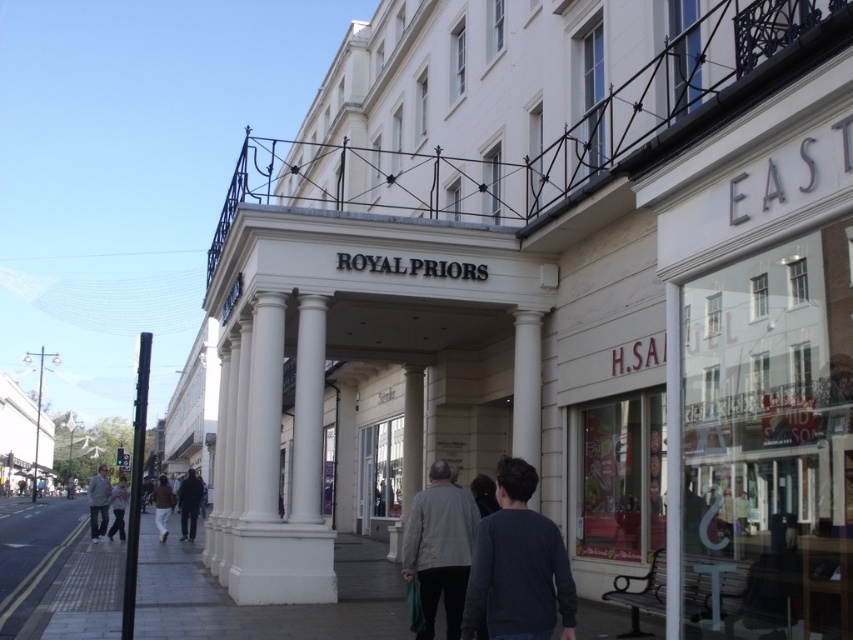
Question: Which point appears farthest from the camera in this image?

Choices:
 (A) (437, 492)
 (B) (117, 515)
 (C) (524, 547)

Answer: (B)

Question: Which object is the farthest from the dark gray sweater at center?

Choices:
 (A) light gray jacket at lower left
 (B) dark blue jacket at center

Answer: (A)

Question: Among these objects, which one is nearest to the camera?

Choices:
 (A) gray concrete pavement at center
 (B) dark gray sweater at center

Answer: (B)

Question: Can you confirm if light gray fabric jacket at center is bigger than light gray fabric jacket at lower left?

Choices:
 (A) yes
 (B) no

Answer: (B)

Question: Does dark gray sweater at center have a larger size compared to brown leather jacket at lower left?

Choices:
 (A) no
 (B) yes

Answer: (A)

Question: In this image, where is gray concrete pavement at center located relative to light gray fabric jacket at center?

Choices:
 (A) below
 (B) above

Answer: (A)